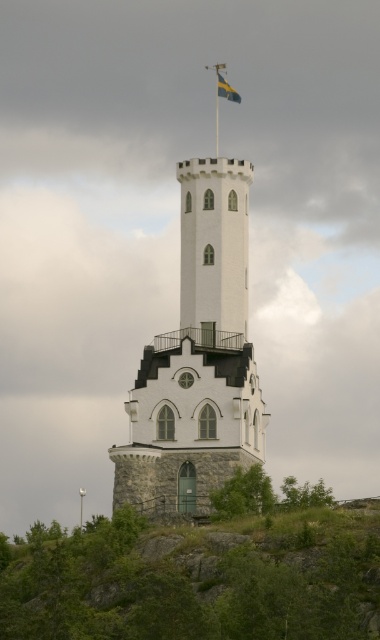
Does green grassy hillside at lower center have a larger size compared to metallic flag pole at top?

Correct, green grassy hillside at lower center is larger in size than metallic flag pole at top.

The width and height of the screenshot is (380, 640). In order to click on green grassy hillside at lower center in this screenshot , I will do `click(197, 579)`.

Who is lower down, green grassy hillside at lower center or blue and yellow striped fabric at top center?

green grassy hillside at lower center is lower down.

Is green grassy hillside at lower center to the left of blue and yellow striped fabric at top center from the viewer's perspective?

Correct, you'll find green grassy hillside at lower center to the left of blue and yellow striped fabric at top center.

Who is more distant from viewer, [53,632] or [232,96]?

Positioned behind is point [232,96].

Where is `green grassy hillside at lower center`? green grassy hillside at lower center is located at coordinates (197, 579).

Can you confirm if white stone spire at center is positioned above blue and yellow striped fabric at top center?

No.

Consider the image. Can you confirm if white stone spire at center is shorter than blue and yellow striped fabric at top center?

No, white stone spire at center is not shorter than blue and yellow striped fabric at top center.

Describe the element at coordinates (197, 358) in the screenshot. I see `white stone spire at center` at that location.

The height and width of the screenshot is (640, 380). Find the location of `white stone spire at center`. white stone spire at center is located at coordinates (197, 358).